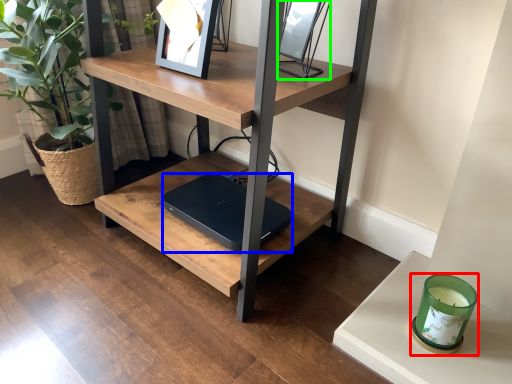
Question: Estimate the real-world distances between objects in this image. Which object is farther from candle holder (highlighted by a red box), laptop (highlighted by a blue box) or picture frame (highlighted by a green box)?

Choices:
 (A) laptop
 (B) picture frame

Answer: (B)